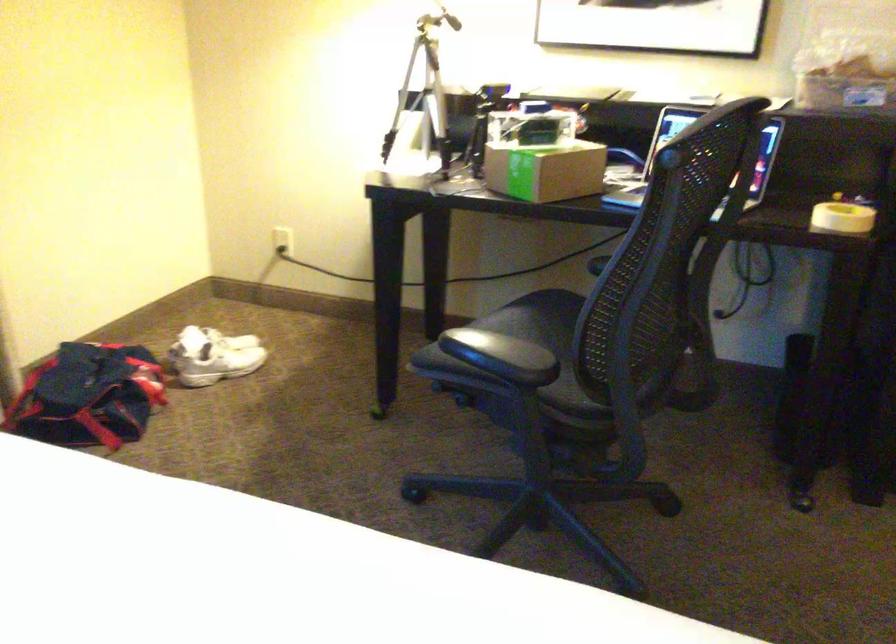
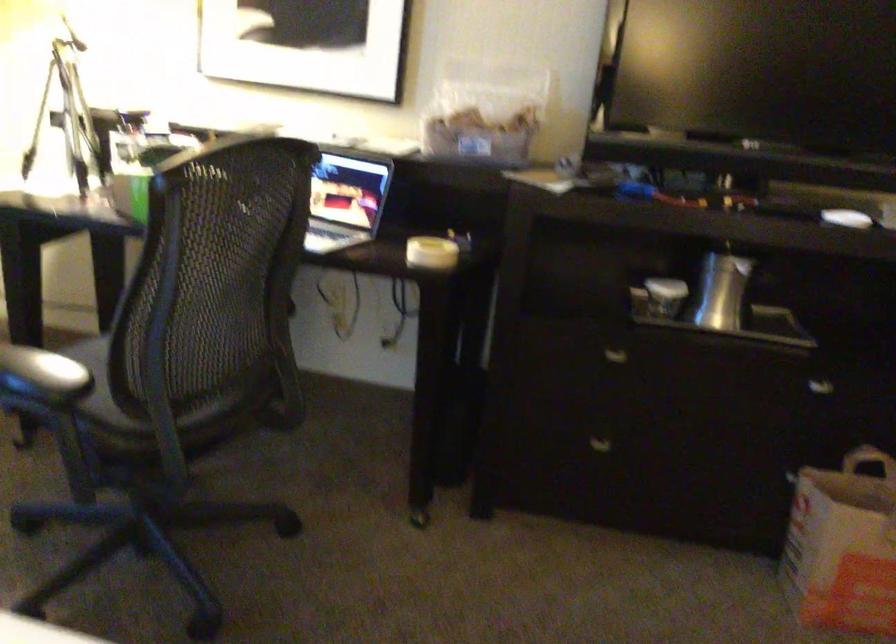
Question: I am providing you with two images of the same scene from different viewpoints. Which of the following objects are not visible in image2?

Choices:
 (A) cardboard box
 (B) white lidded cup
 (C) paper bag handle
 (D) red office tool

Answer: (A)